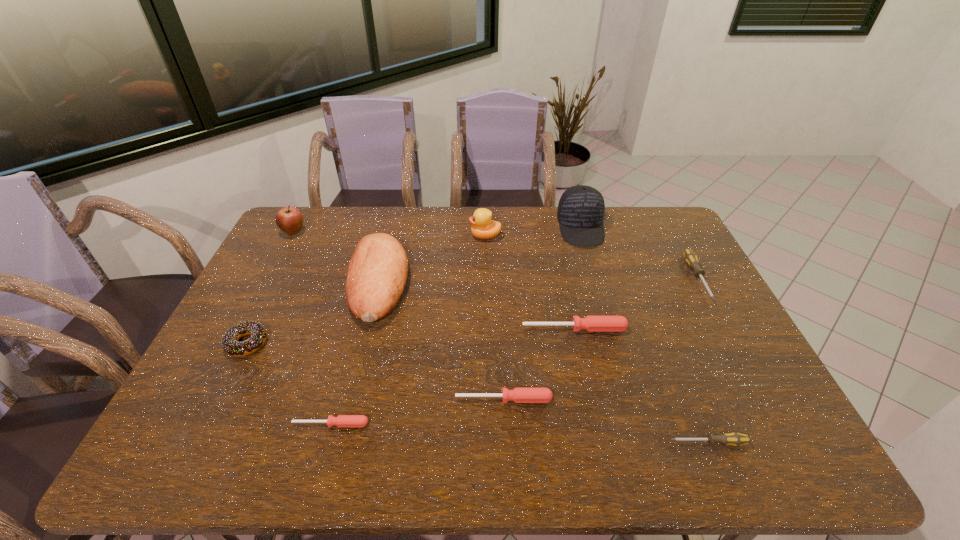
This screenshot has height=540, width=960. What are the coordinates of `the second nearest red screwdriver` in the screenshot? It's located at [519, 395].

In order to click on the left gray screwdriver in this screenshot , I will do `click(736, 439)`.

I want to click on the nearest object, so click(736, 439).

The width and height of the screenshot is (960, 540). Identify the location of the nearest red screwdriver. (342, 420).

Locate an element on the screen. The height and width of the screenshot is (540, 960). the leftmost screwdriver is located at coordinates (342, 420).

The width and height of the screenshot is (960, 540). What are the coordinates of `free region located 0.180m at the front of the baseball cap where the brim is located` in the screenshot? It's located at (597, 284).

Identify the location of vacant space located 0.050m on the right of the apple. This screenshot has height=540, width=960. (320, 232).

Identify the location of vacant space located on the face of the duckling. This screenshot has height=540, width=960. (447, 236).

Identify the location of vacant space situated on the face of the duckling. (397, 236).

Find the location of a particular element. blank space located on the face of the duckling is located at coordinates (450, 236).